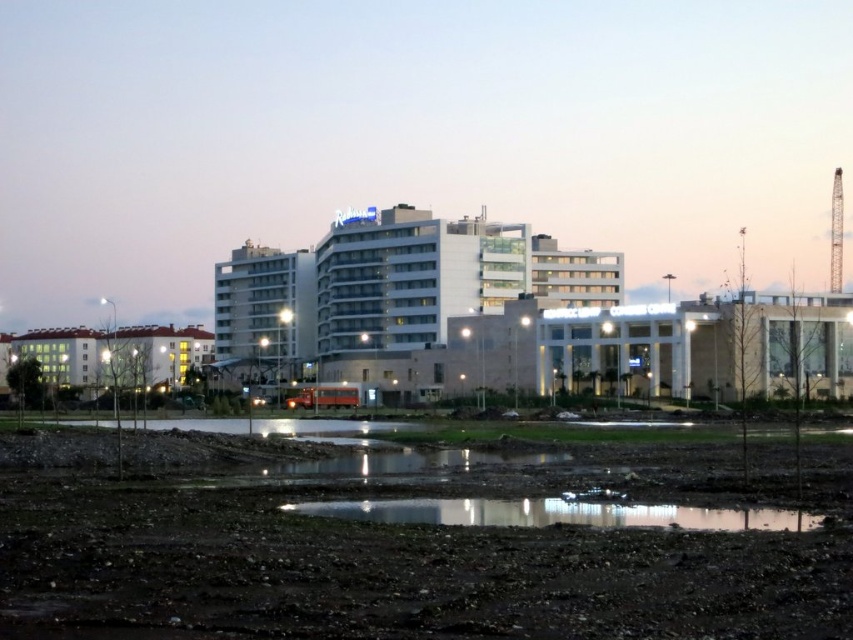
You are a delivery robot with a 1 meter wide package. You need to navigate through the dull brown dirt at lower center and the glossy concrete puddle at lower center. Which path should you choose to avoid getting stuck?

The dull brown dirt at lower center is larger in size than the glossy concrete puddle at lower center, so you should choose the dull brown dirt at lower center to avoid getting stuck since it has more space for the robot to move through.

You are a photographer standing at the camera position. You want to capture a closeup shot of the dull brown dirt at lower center without moving your camera. Is it possible to do so with a standard lens that has a minimum focusing distance of 1 meter?

The dull brown dirt at lower center is 10.97 meters from the camera. Since the minimum focusing distance of the standard lens is 1 meter, the photographer can easily focus on the dull brown dirt at lower center from this distance.

You are standing at the point marked by the coordinates point (397, 547) in the image. Based on the scene description, what is the terrain like at that location?

The terrain at point (397, 547) is dull brown dirt at lower center, as indicated by the coordinates.